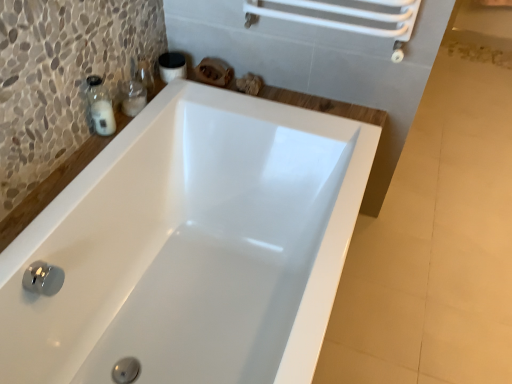
Question: Is transparent glass soap dispenser at upper left smaller than white glossy bathtub at center?

Choices:
 (A) no
 (B) yes

Answer: (B)

Question: Is transparent glass soap dispenser at upper left not inside white glossy bathtub at center?

Choices:
 (A) no
 (B) yes

Answer: (B)

Question: Does transparent glass soap dispenser at upper left appear on the right side of white glossy bathtub at center?

Choices:
 (A) yes
 (B) no

Answer: (B)

Question: From the image's perspective, is transparent glass soap dispenser at upper left under white glossy bathtub at center?

Choices:
 (A) no
 (B) yes

Answer: (A)

Question: Is transparent glass soap dispenser at upper left further to camera compared to white glossy bathtub at center?

Choices:
 (A) no
 (B) yes

Answer: (B)

Question: Considering the relative sizes of transparent glass soap dispenser at upper left and white glossy bathtub at center in the image provided, is transparent glass soap dispenser at upper left thinner than white glossy bathtub at center?

Choices:
 (A) no
 (B) yes

Answer: (B)

Question: Is white glossy bathtub at center located outside transparent glass soap dispenser at upper left?

Choices:
 (A) yes
 (B) no

Answer: (A)

Question: Is white glossy bathtub at center facing towards transparent glass soap dispenser at upper left?

Choices:
 (A) yes
 (B) no

Answer: (B)

Question: Does white glossy bathtub at center have a lesser height compared to transparent glass soap dispenser at upper left?

Choices:
 (A) yes
 (B) no

Answer: (B)

Question: Can you confirm if white glossy bathtub at center is positioned to the right of transparent glass soap dispenser at upper left?

Choices:
 (A) no
 (B) yes

Answer: (B)

Question: Can you confirm if white glossy bathtub at center is positioned to the left of transparent glass soap dispenser at upper left?

Choices:
 (A) no
 (B) yes

Answer: (A)

Question: From the image's perspective, is white glossy bathtub at center under transparent glass soap dispenser at upper left?

Choices:
 (A) no
 (B) yes

Answer: (B)

Question: Is transparent glass soap dispenser at upper left to the left or to the right of white glossy bathtub at center in the image?

Choices:
 (A) left
 (B) right

Answer: (A)